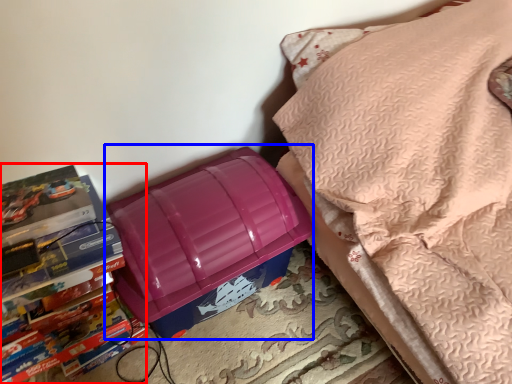
Question: Which object appears farthest to the camera in this image, book (highlighted by a red box) or lunch box (highlighted by a blue box)?

Choices:
 (A) book
 (B) lunch box

Answer: (B)